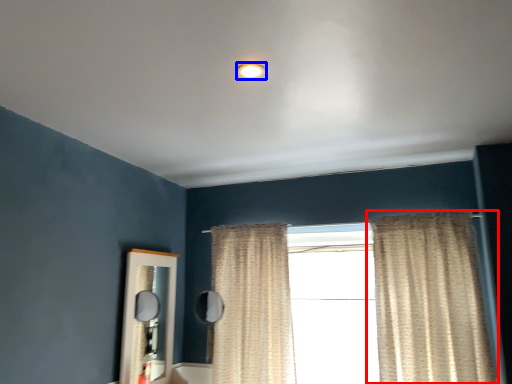
Question: Which object appears farthest to the camera in this image, curtain (highlighted by a red box) or lighting (highlighted by a blue box)?

Choices:
 (A) curtain
 (B) lighting

Answer: (A)